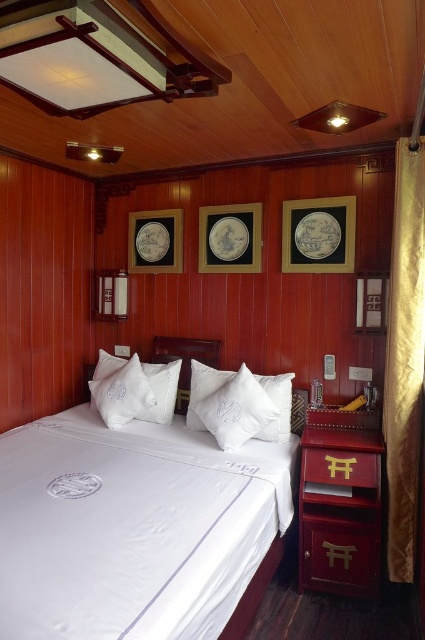
Describe the element at coordinates (319, 234) in the screenshot. I see `matte black picture frame at upper right` at that location.

Which of these two, matte black picture frame at upper right or matte black picture frame at upper left, stands shorter?

With less height is matte black picture frame at upper left.

The height and width of the screenshot is (640, 425). Find the location of `matte black picture frame at upper right`. matte black picture frame at upper right is located at coordinates (319, 234).

Locate an element on the screen. matte black picture frame at upper right is located at coordinates (319, 234).

Who is positioned more to the right, gold textured curtain at right or matte black picture frame at center?

gold textured curtain at right

From the picture: Is gold textured curtain at right further to camera compared to matte black picture frame at center?

No, it is not.

Who is more distant from viewer, (393,324) or (244,269)?

The point (244,269) is more distant.

Image resolution: width=425 pixels, height=640 pixels. I want to click on gold textured curtain at right, so click(x=405, y=356).

Can you confirm if gold textured curtain at right is positioned to the right of matte black picture frame at upper right?

Indeed, gold textured curtain at right is positioned on the right side of matte black picture frame at upper right.

Locate an element on the screen. gold textured curtain at right is located at coordinates (405, 356).

Identify the location of gold textured curtain at right. This screenshot has height=640, width=425. (405, 356).